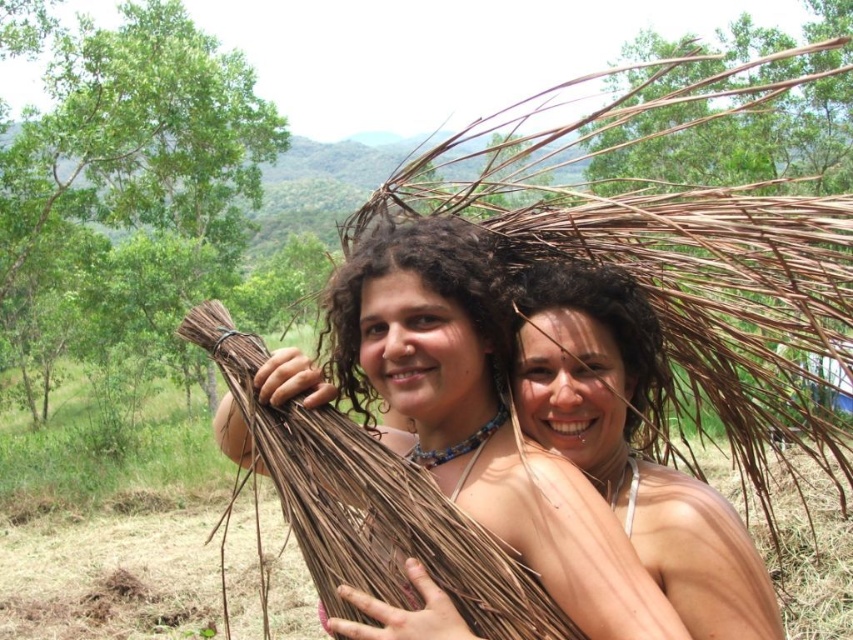
Question: Is the position of dark curly hair at center less distant than that of dark brown hair at center?

Choices:
 (A) no
 (B) yes

Answer: (B)

Question: Which point is closer to the camera?

Choices:
 (A) (456, 227)
 (B) (515, 305)
 (C) (653, 310)
 (D) (450, 488)

Answer: (D)

Question: Does dark curly hair at center have a smaller size compared to dark brown hair at center?

Choices:
 (A) yes
 (B) no

Answer: (A)

Question: Does dark curly hair at center appear on the right side of dark brown hair at center?

Choices:
 (A) yes
 (B) no

Answer: (B)

Question: Which point appears farthest from the camera in this image?

Choices:
 (A) (401, 244)
 (B) (589, 384)
 (C) (386, 275)
 (D) (628, 403)

Answer: (B)

Question: Which point is farther from the camera taking this photo?

Choices:
 (A) (282, 381)
 (B) (625, 275)

Answer: (B)